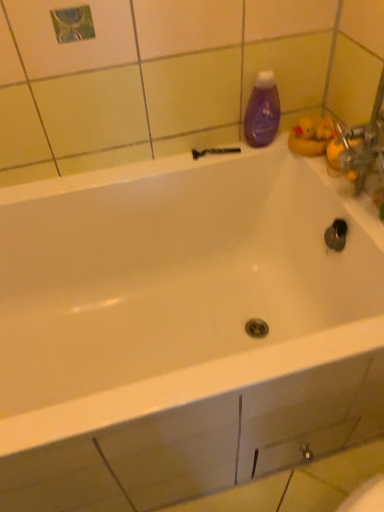
Describe the element at coordinates (214, 151) in the screenshot. The width and height of the screenshot is (384, 512). I see `black plastic shower at upper center` at that location.

The image size is (384, 512). I want to click on black plastic shower at upper center, so click(214, 151).

Where is `purple glossy bottle at upper right`? The height and width of the screenshot is (512, 384). purple glossy bottle at upper right is located at coordinates (262, 111).

The image size is (384, 512). Describe the element at coordinates (262, 111) in the screenshot. I see `purple glossy bottle at upper right` at that location.

Identify the location of black plastic shower at upper center. The height and width of the screenshot is (512, 384). (214, 151).

Considering the positions of objects purple glossy bottle at upper right and black plastic shower at upper center in the image provided, who is more to the right, purple glossy bottle at upper right or black plastic shower at upper center?

purple glossy bottle at upper right is more to the right.

Which is behind, purple glossy bottle at upper right or black plastic shower at upper center?

Positioned behind is black plastic shower at upper center.

Which is behind, point (270, 93) or point (225, 150)?

The point (225, 150) is farther from the camera.

From the image's perspective, which is below, purple glossy bottle at upper right or black plastic shower at upper center?

black plastic shower at upper center appears lower in the image.

From a real-world perspective, is purple glossy bottle at upper right physically located above or below black plastic shower at upper center?

purple glossy bottle at upper right is above black plastic shower at upper center.

Considering the sizes of objects purple glossy bottle at upper right and black plastic shower at upper center in the image provided, who is thinner, purple glossy bottle at upper right or black plastic shower at upper center?

Thinner between the two is black plastic shower at upper center.

From the picture: Between purple glossy bottle at upper right and black plastic shower at upper center, which one has less height?

With less height is black plastic shower at upper center.

From the picture: Between purple glossy bottle at upper right and black plastic shower at upper center, which one has larger size?

purple glossy bottle at upper right is bigger.

Can we say purple glossy bottle at upper right lies outside black plastic shower at upper center?

That's correct, purple glossy bottle at upper right is outside of black plastic shower at upper center.

Would you say purple glossy bottle at upper right is a long distance from black plastic shower at upper center?

No, purple glossy bottle at upper right is not far from black plastic shower at upper center.

Is purple glossy bottle at upper right turned away from black plastic shower at upper center?

No, purple glossy bottle at upper right's orientation is not away from black plastic shower at upper center.

How far apart are purple glossy bottle at upper right and black plastic shower at upper center?

purple glossy bottle at upper right is 4.94 inches from black plastic shower at upper center.

The image size is (384, 512). Identify the location of shower below the purple glossy bottle at upper right (from a real-world perspective). (214, 151).

Between black plastic shower at upper center and purple glossy bottle at upper right, which one appears on the left side from the viewer's perspective?

Positioned to the left is black plastic shower at upper center.

Is the depth of black plastic shower at upper center greater than that of purple glossy bottle at upper right?

Yes, the depth of black plastic shower at upper center is greater than that of purple glossy bottle at upper right.

Does point (210, 151) come in front of point (266, 144)?

No, (210, 151) is behind (266, 144).

From the image's perspective, is black plastic shower at upper center located above or below purple glossy bottle at upper right?

Based on their image positions, black plastic shower at upper center is located beneath purple glossy bottle at upper right.

From a real-world perspective, is black plastic shower at upper center under purple glossy bottle at upper right?

Yes, from a real-world perspective, black plastic shower at upper center is under purple glossy bottle at upper right.

Does black plastic shower at upper center have a greater width compared to purple glossy bottle at upper right?

No, black plastic shower at upper center is not wider than purple glossy bottle at upper right.

Considering the sizes of black plastic shower at upper center and purple glossy bottle at upper right in the image, is black plastic shower at upper center taller or shorter than purple glossy bottle at upper right?

In the image, black plastic shower at upper center appears to be shorter than purple glossy bottle at upper right.

Does black plastic shower at upper center have a smaller size compared to purple glossy bottle at upper right?

Indeed, black plastic shower at upper center has a smaller size compared to purple glossy bottle at upper right.

Is purple glossy bottle at upper right completely or partially inside black plastic shower at upper center?

Actually, purple glossy bottle at upper right is outside black plastic shower at upper center.

Are black plastic shower at upper center and purple glossy bottle at upper right located far from each other?

No.

Is purple glossy bottle at upper right at the back of black plastic shower at upper center?

black plastic shower at upper center does not have its back to purple glossy bottle at upper right.

Where is `cleaning product located above the black plastic shower at upper center (from a real-world perspective)`? The width and height of the screenshot is (384, 512). cleaning product located above the black plastic shower at upper center (from a real-world perspective) is located at coordinates (262, 111).

The image size is (384, 512). In order to click on cleaning product on the right of black plastic shower at upper center in this screenshot , I will do `click(262, 111)`.

Where is `cleaning product above the black plastic shower at upper center (from a real-world perspective)`? cleaning product above the black plastic shower at upper center (from a real-world perspective) is located at coordinates (262, 111).